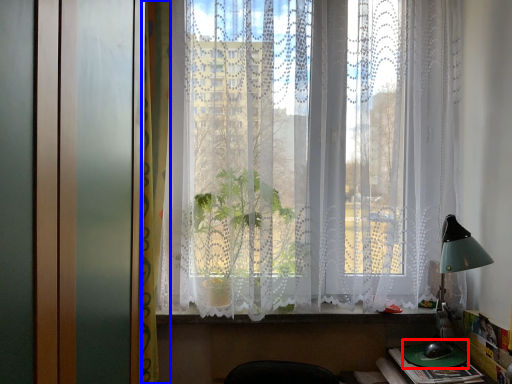
Question: Among these objects, which one is farthest to the camera, round table (highlighted by a red box) or curtain (highlighted by a blue box)?

Choices:
 (A) round table
 (B) curtain

Answer: (A)